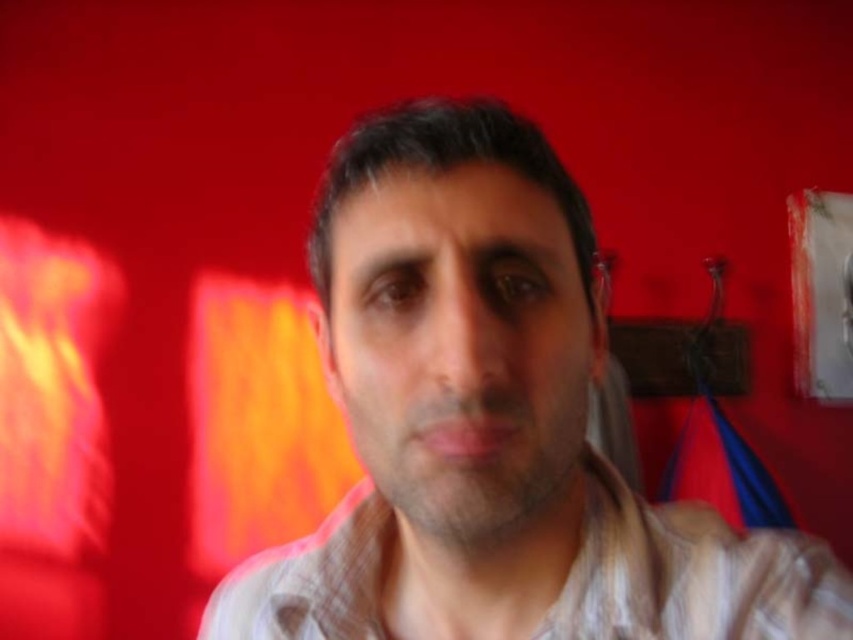
You are standing in the scene and want to move from the point at coordinates point (462, 480) to the point at coordinates point (802, 624). Can you directly walk in a straight line between them without any obstacles?

Yes, since point (462, 480) is in front of point (802, 624), there are no obstacles blocking the straight path between them.

You are a fashion stylist trying to determine the layering of the shirts in the image. Which shirt is visible on top, the light beige striped shirt at center or the brown plaid shirt at center?

The light beige striped shirt at center is in front of the brown plaid shirt at center, so the light beige striped shirt at center is visible on top.

You are standing in front of the image. There is a point at coordinates [492,422]. What object is located at this point?

The point at coordinates [492,422] corresponds to the light beige striped shirt at center.